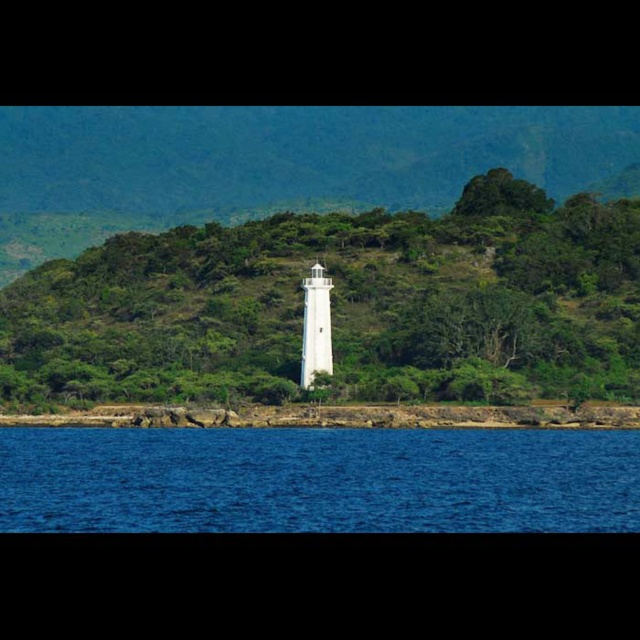
You are a photographer positioned at the origin point of the image coordinate system, which is the bottom left corner. You want to capture the white smooth lighthouse at center in your shot. What are the coordinates of the lighthouse?

The coordinates of the white smooth lighthouse at center are at point (x=342, y=305).

You are a bird flying over the coastal landscape. You see the white smooth lighthouse at center and the blue liquid water at lower center. Which object is higher in elevation?

The white smooth lighthouse at center is above the blue liquid water at lower center, so the white smooth lighthouse at center is higher in elevation.

You are standing at the point marked as point [342,305] in the image. What object is directly in front of you?

The white smooth lighthouse at center is directly in front of you at point [342,305].